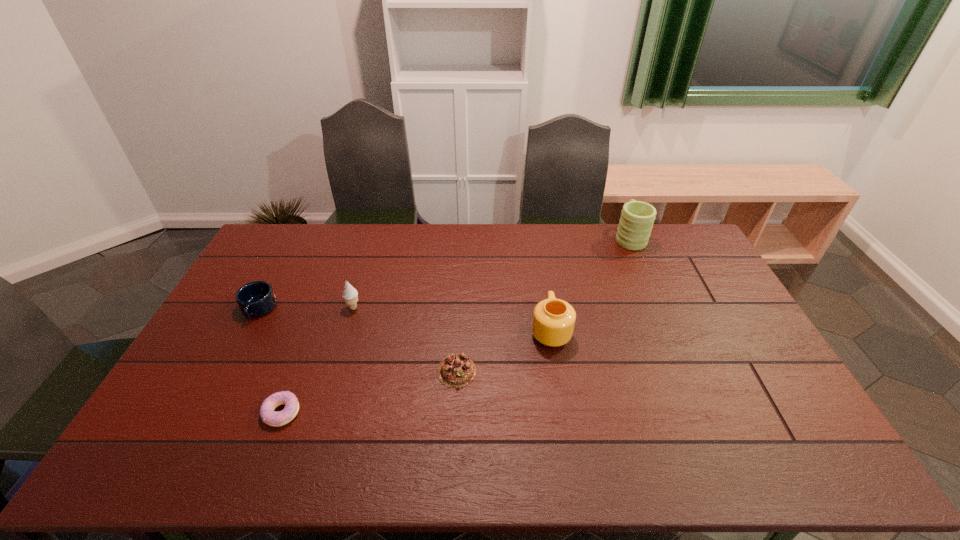
You are a GUI agent. You are given a task and a screenshot of the screen. Output one action in this format:
    pyautogui.click(x=<x>, y=<y>)
    Task: Click on the vacant space at the far edge of the desktop
    This screenshot has width=960, height=540.
    Given the screenshot: What is the action you would take?
    pyautogui.click(x=522, y=231)

Locate an element on the screen. The height and width of the screenshot is (540, 960). free point at the left edge is located at coordinates (221, 348).

At what (x,y) coordinates should I click in order to perform the action: click on vacant space at the right edge. Please return your answer as a coordinate pair (x, y). This screenshot has width=960, height=540. Looking at the image, I should click on (737, 345).

Where is `vacant space at the far left corner of the desktop`? vacant space at the far left corner of the desktop is located at coordinates (304, 232).

Identify the location of vacant space at the far right corner of the desktop. Image resolution: width=960 pixels, height=540 pixels. (684, 239).

At what (x,y) coordinates should I click in order to perform the action: click on vacant area that lies between the doughnut and the farthest object. Please return your answer as a coordinate pair (x, y). Image resolution: width=960 pixels, height=540 pixels. Looking at the image, I should click on (456, 325).

Identify the location of empty space between the fourth object from right to left and the third shortest object. coord(306,308).

The height and width of the screenshot is (540, 960). Find the location of `free space between the icecream and the second mug from right to left`. free space between the icecream and the second mug from right to left is located at coordinates (452, 319).

At what (x,y) coordinates should I click in order to perform the action: click on vacant region between the fifth tallest object and the leftmost object. Please return your answer as a coordinate pair (x, y). This screenshot has width=960, height=540. Looking at the image, I should click on (357, 340).

In order to click on vacant area that lies between the fifth object from right to left and the fifth object from left to right in this screenshot , I will do click(x=417, y=371).